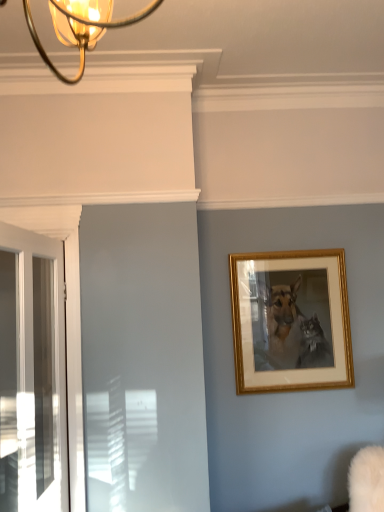
The height and width of the screenshot is (512, 384). What are the coordinates of `gold/golden frame at upper right` in the screenshot? It's located at (291, 321).

Measure the distance between point [328,356] and camera.

7.67 feet.

The image size is (384, 512). What do you see at coordinates (291, 321) in the screenshot?
I see `gold/golden frame at upper right` at bounding box center [291, 321].

Measure the distance between point (34, 372) and camera.

The distance of point (34, 372) from camera is 2.03 meters.

The height and width of the screenshot is (512, 384). What do you see at coordinates (34, 366) in the screenshot?
I see `white glossy door at left` at bounding box center [34, 366].

In order to click on white glossy door at left in this screenshot , I will do `click(34, 366)`.

Where is `gold/golden frame at upper right`? gold/golden frame at upper right is located at coordinates (291, 321).

Which is more to the left, gold/golden frame at upper right or white glossy door at left?

Positioned to the left is white glossy door at left.

Is the position of gold/golden frame at upper right more distant than that of white glossy door at left?

Yes, gold/golden frame at upper right is further from the camera.

Is point (273, 358) closer or farther from the camera than point (56, 462)?

Clearly, point (273, 358) is more distant from the camera than point (56, 462).

From the image's perspective, is gold/golden frame at upper right positioned above or below white glossy door at left?

gold/golden frame at upper right is above white glossy door at left.

From a real-world perspective, is gold/golden frame at upper right positioned above or below white glossy door at left?

From a real-world perspective, gold/golden frame at upper right is physically above white glossy door at left.

Looking at their sizes, would you say gold/golden frame at upper right is wider or thinner than white glossy door at left?

gold/golden frame at upper right is thinner than white glossy door at left.

From their relative heights in the image, would you say gold/golden frame at upper right is taller or shorter than white glossy door at left?

Clearly, gold/golden frame at upper right is shorter compared to white glossy door at left.

Can you confirm if gold/golden frame at upper right is bigger than white glossy door at left?

Actually, gold/golden frame at upper right might be smaller than white glossy door at left.

Do you think gold/golden frame at upper right is within white glossy door at left, or outside of it?

gold/golden frame at upper right cannot be found inside white glossy door at left.

Is gold/golden frame at upper right placed right next to white glossy door at left?

gold/golden frame at upper right and white glossy door at left are clearly separated.

From the picture: Is gold/golden frame at upper right facing away from white glossy door at left?

gold/golden frame at upper right is not turned away from white glossy door at left.

Can you tell me how much gold/golden frame at upper right and white glossy door at left differ in facing direction?

4.77 degrees separate the facing orientations of gold/golden frame at upper right and white glossy door at left.

The height and width of the screenshot is (512, 384). In order to click on door lying on the left of gold/golden frame at upper right in this screenshot , I will do `click(34, 366)`.

Between white glossy door at left and gold/golden frame at upper right, which one appears on the right side from the viewer's perspective?

gold/golden frame at upper right.

Is white glossy door at left in front of or behind gold/golden frame at upper right in the image?

In the image, white glossy door at left appears in front of gold/golden frame at upper right.

Is point (67, 492) positioned in front of point (322, 353)?

Yes, it is.

From the image's perspective, relative to gold/golden frame at upper right, is white glossy door at left above or below?

From the image's perspective, white glossy door at left appears below gold/golden frame at upper right.

From a real-world perspective, is white glossy door at left below gold/golden frame at upper right?

Correct, in the physical world, white glossy door at left is lower than gold/golden frame at upper right.

Which of these two, white glossy door at left or gold/golden frame at upper right, is thinner?

With smaller width is gold/golden frame at upper right.

Between white glossy door at left and gold/golden frame at upper right, which one has less height?

With less height is gold/golden frame at upper right.

Considering the relative sizes of white glossy door at left and gold/golden frame at upper right in the image provided, is white glossy door at left bigger than gold/golden frame at upper right?

Yes.

Is white glossy door at left outside of gold/golden frame at upper right?

Absolutely, white glossy door at left is external to gold/golden frame at upper right.

Is white glossy door at left directly adjacent to gold/golden frame at upper right?

There is a gap between white glossy door at left and gold/golden frame at upper right.

Is white glossy door at left facing away from gold/golden frame at upper right?

white glossy door at left is not turned away from gold/golden frame at upper right.

In the scene shown: What's the angular difference between white glossy door at left and gold/golden frame at upper right's facing directions?

They differ by 4.77 degrees in their facing directions.

Looking at this image, how much distance is there between white glossy door at left and gold/golden frame at upper right?

The distance of white glossy door at left from gold/golden frame at upper right is 1.15 meters.

Where is `picture frame above the white glossy door at left (from the image's perspective)`? Image resolution: width=384 pixels, height=512 pixels. picture frame above the white glossy door at left (from the image's perspective) is located at coordinates (291, 321).

Image resolution: width=384 pixels, height=512 pixels. What are the coordinates of `picture frame located behind the white glossy door at left` in the screenshot? It's located at (291, 321).

Find the location of a particular element. The height and width of the screenshot is (512, 384). picture frame above the white glossy door at left (from a real-world perspective) is located at coordinates (291, 321).